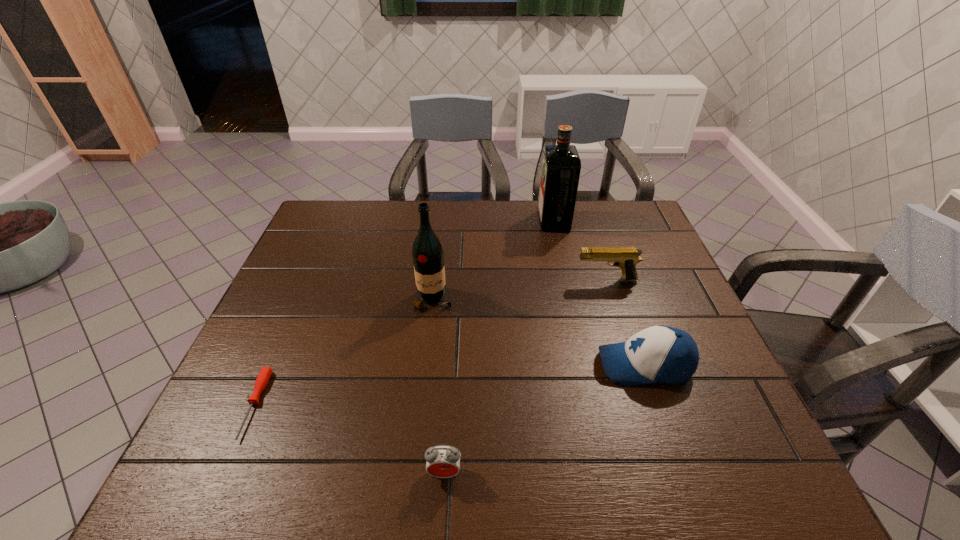
This screenshot has width=960, height=540. Find the location of `free spot between the leftmost object and the baseball cap`. free spot between the leftmost object and the baseball cap is located at coordinates (449, 385).

Find the location of a particular element. vacant area that lies between the baseball cap and the alarm clock is located at coordinates (544, 419).

Locate an element on the screen. This screenshot has height=540, width=960. free space between the wine bottle and the baseball cap is located at coordinates (539, 333).

The height and width of the screenshot is (540, 960). I want to click on vacant space that is in between the pistol and the wine bottle, so click(519, 290).

Identify the location of vacant point located between the farthest object and the nearest object. Image resolution: width=960 pixels, height=540 pixels. (499, 347).

Locate an element on the screen. The width and height of the screenshot is (960, 540). empty location between the alarm clock and the baseball cap is located at coordinates (544, 419).

Identify the location of empty location between the pistol and the shortest object. The height and width of the screenshot is (540, 960). (430, 342).

At what (x,y) coordinates should I click in order to perform the action: click on unoccupied position between the farthest object and the baseball cap. Please return your answer as a coordinate pair (x, y). Looking at the image, I should click on (599, 293).

The image size is (960, 540). Identify the location of free space between the nearest object and the third farthest object. (439, 386).

In order to click on vacant space that's between the leftmost object and the baseball cap in this screenshot , I will do `click(449, 385)`.